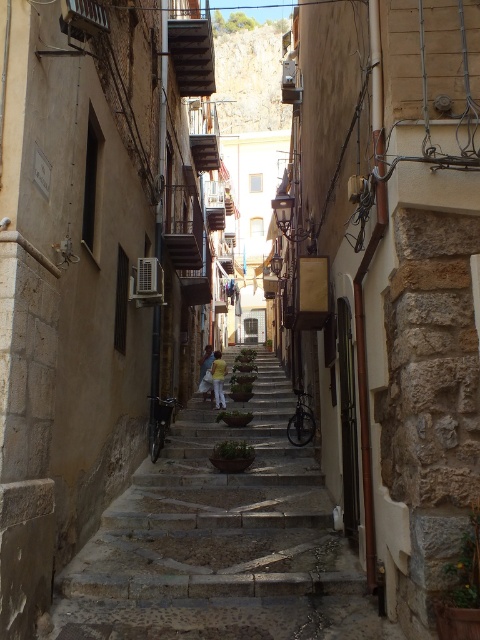
How distant is yellow cotton shirt at center from light blue jeans at center?

yellow cotton shirt at center and light blue jeans at center are 15.37 feet apart.

Who is shorter, yellow cotton shirt at center or light blue jeans at center?

light blue jeans at center is shorter.

Does point (219, 374) come behind point (203, 371)?

That is False.

You are a GUI agent. You are given a task and a screenshot of the screen. Output one action in this format:
    pyautogui.click(x=<x>, y=<y>)
    Task: Click on the yellow cotton shirt at center
    This screenshot has width=480, height=640.
    Given the screenshot: What is the action you would take?
    pyautogui.click(x=218, y=380)

The width and height of the screenshot is (480, 640). In order to click on stone textured stairs at center in this screenshot , I will do `click(219, 541)`.

Which is behind, point (84, 568) or point (219, 387)?

The point (219, 387) is behind.

Between point (260, 436) and point (216, 372), which one is positioned behind?

Point (216, 372)

Image resolution: width=480 pixels, height=640 pixels. Find the location of `stone textured stairs at center`. stone textured stairs at center is located at coordinates (219, 541).

Can you confirm if stone textured stairs at center is positioned above light blue jeans at center?

No.

Looking at this image, which of these two, stone textured stairs at center or light blue jeans at center, stands taller?

With more height is stone textured stairs at center.

Identify the location of stone textured stairs at center. (219, 541).